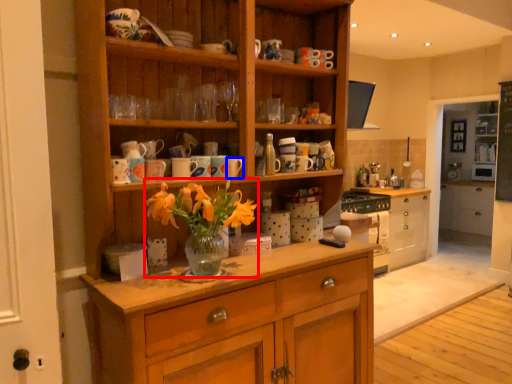
Question: Which of the following is the closest to the observer, floral arrangement (highlighted by a red box) or mug (highlighted by a blue box)?

Choices:
 (A) floral arrangement
 (B) mug

Answer: (A)